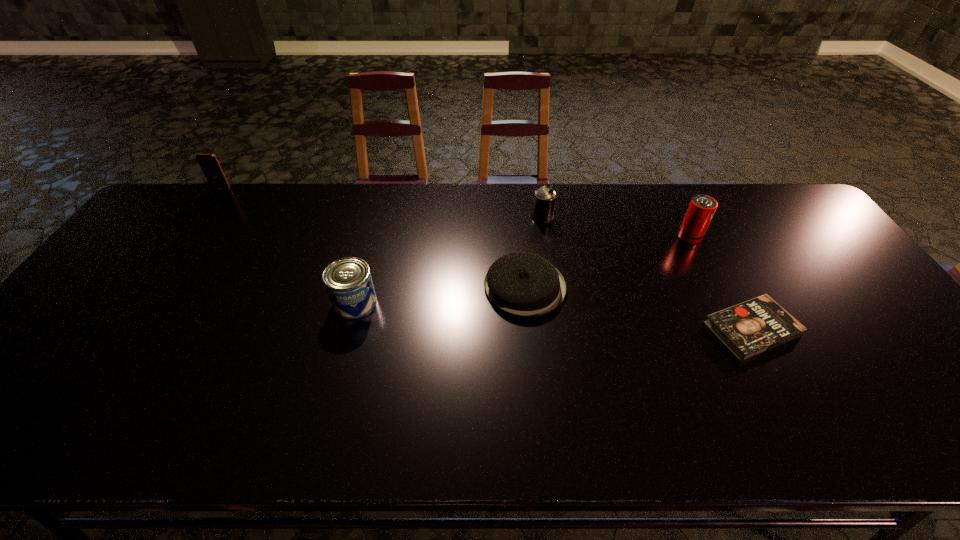
You are a GUI agent. You are given a task and a screenshot of the screen. Output one action in this format:
    pyautogui.click(x=<x>, y=<y>)
    Task: Click on the free space that is in between the shortest object and the second farthest object
    The width and height of the screenshot is (960, 540).
    Given the screenshot: What is the action you would take?
    pyautogui.click(x=647, y=273)

I want to click on free spot between the rightmost can and the fifth tallest object, so 608,261.

At what (x,y) coordinates should I click in order to perform the action: click on free space that is in between the book and the leftmost can. Please return your answer as a coordinate pair (x, y). Looking at the image, I should click on (553, 316).

Image resolution: width=960 pixels, height=540 pixels. What are the coordinates of `vacant space that's between the book and the fifth tallest object` in the screenshot? It's located at (638, 308).

Where is `empty space between the book and the fourth nearest object`? This screenshot has height=540, width=960. empty space between the book and the fourth nearest object is located at coordinates (721, 283).

Select which object is the third closest to the cellular telephone. Please provide its 2D coordinates. Your answer should be formatted as a tuple, i.e. [(x, y)], where the tuple contains the x and y coordinates of a point satisfying the conditions above.

[(544, 202)]

Identify which object is the fifth nearest to the book. Please provide its 2D coordinates. Your answer should be formatted as a tuple, i.e. [(x, y)], where the tuple contains the x and y coordinates of a point satisfying the conditions above.

[(209, 164)]

Where is `can that is the third nearest to the shortest object`? This screenshot has width=960, height=540. can that is the third nearest to the shortest object is located at coordinates (348, 282).

Locate which can ranks second in proximity to the nearest can. Please provide its 2D coordinates. Your answer should be formatted as a tuple, i.e. [(x, y)], where the tuple contains the x and y coordinates of a point satisfying the conditions above.

[(701, 209)]

This screenshot has width=960, height=540. What are the coordinates of `blank space that satisfies the following two spatial constraints: 1. on the front side of the fifth nearest object; 2. on the right side of the second farthest can` in the screenshot? It's located at pyautogui.click(x=545, y=237).